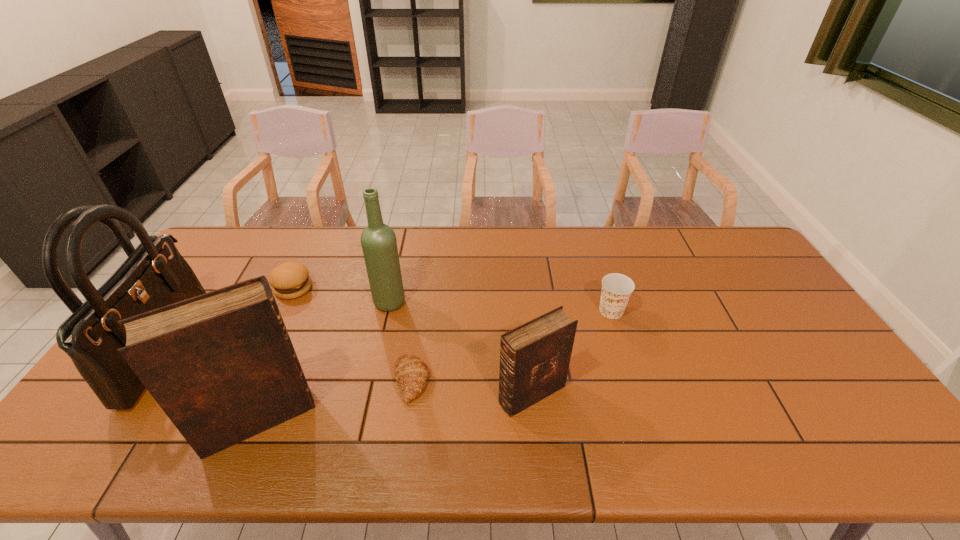
All Bibles are currently evenly spaced. To continue this pattern, where would you add another Bible on the right? Please point out a vacant spot. Please provide its 2D coordinates. Your answer should be formatted as a tuple, i.e. [(x, y)], where the tuple contains the x and y coordinates of a point satisfying the conditions above.

[(780, 371)]